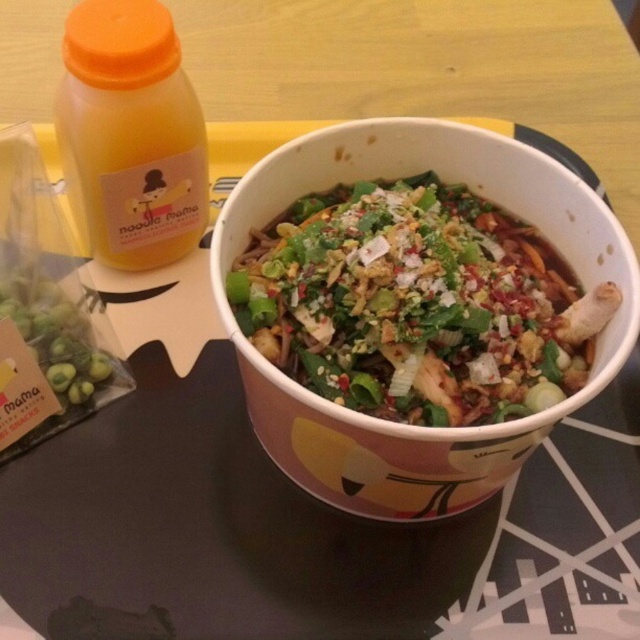
You are a food delivery person who needs to pack the white paper bowl at center and the green matte olives at lower left into a box. The box can only hold items that are not overlapping. Can you fit both items into the box without overlapping?

The white paper bowl at center is in front of the green matte olives at lower left, meaning they are already overlapping in the image. Therefore, you cannot fit both items into the box without overlapping.

You are a food delivery person who needs to pack the white paper bowl at center and the green matte olives at lower left into a box. The box can only fit items that are narrower than the bowl. Can you safely place both items in the box?

The white paper bowl at center is wider than the green matte olives at lower left. Since the box can only fit items narrower than the bowl, the olives will fit, but the bowl itself may not. Therefore, you cannot safely place both items in the box.

Based on the photo, you are a food delivery person who needs to place the orange plastic bottle at upper left and the green matte olives at lower left into a small cooler bag. The cooler bag can only hold items that are smaller than the bottle. Can both items fit?

The orange plastic bottle at upper left is bigger than green matte olives at lower left. Since the cooler bag can only hold items smaller than the bottle, the green matte olives at lower left can fit, but the orange plastic bottle at upper left cannot.